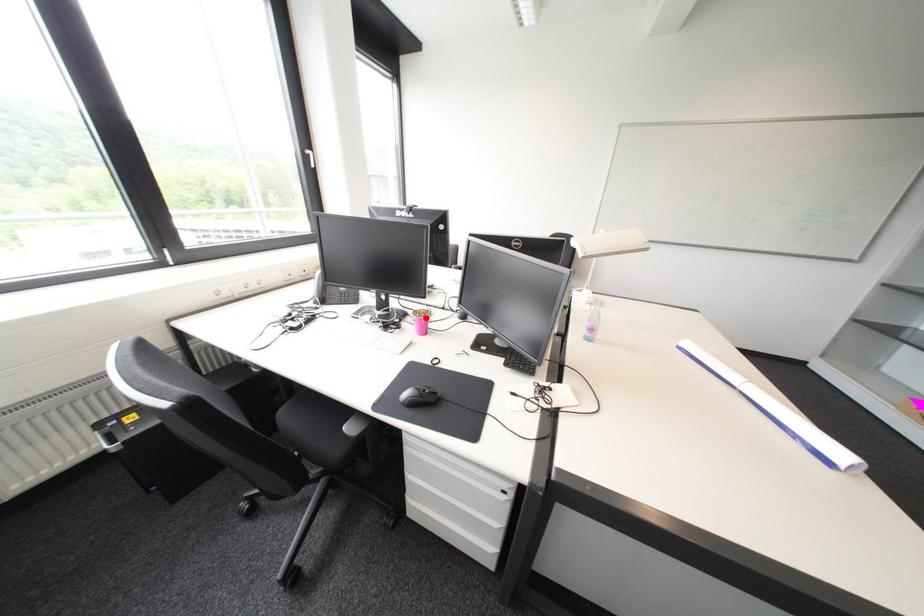
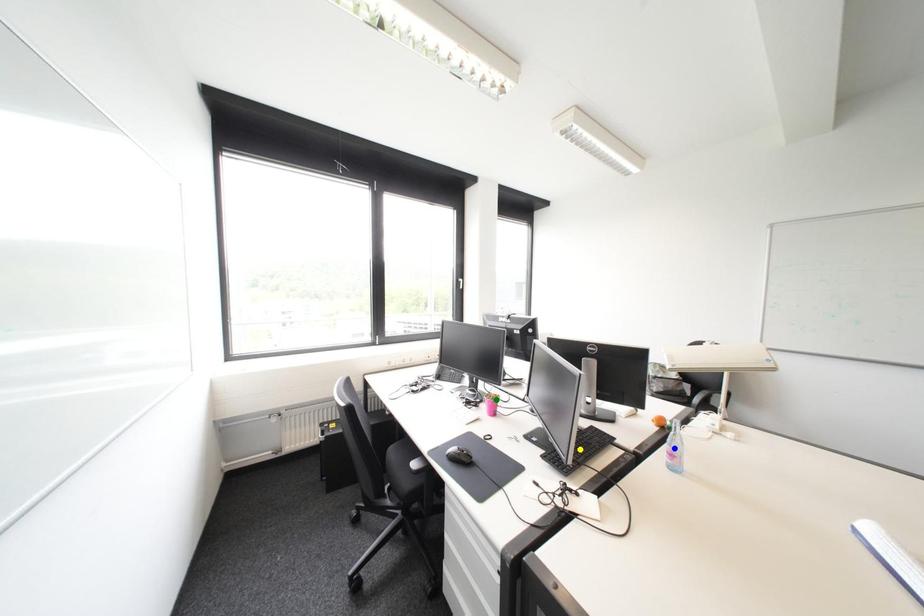
Question: I am providing you with two images of the same scene from different viewpoints. A red point is marked on the first image. You are given multiple points on the second image. Which point in image 2 represents the same 3d spot as the red point in image 1?

Choices:
 (A) blue point
 (B) yellow point
 (C) green point

Answer: (C)